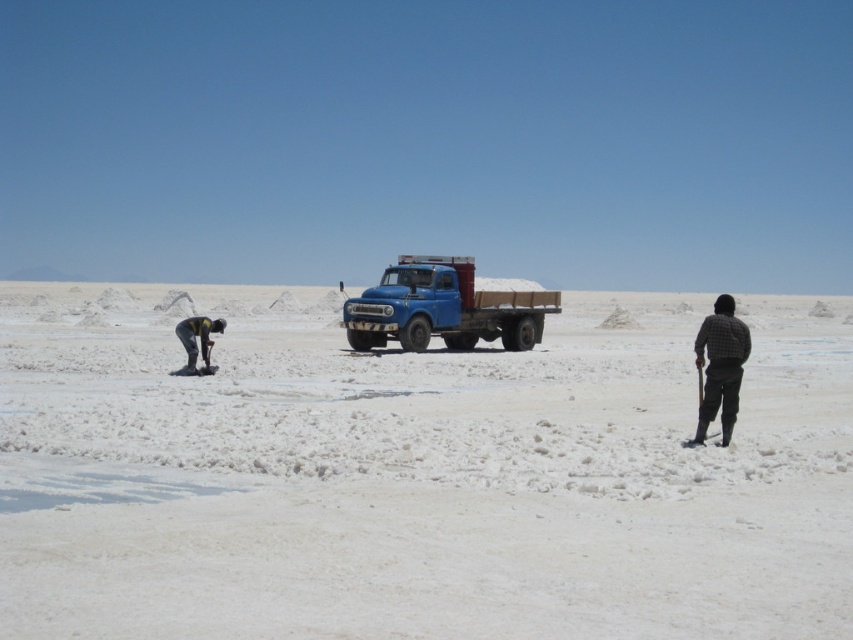
Question: Which point appears farthest from the camera in this image?

Choices:
 (A) (155, 572)
 (B) (735, 403)
 (C) (198, 324)
 (D) (451, 282)

Answer: (D)

Question: Is white sandy desert at center bigger than blue matte truck at center?

Choices:
 (A) no
 (B) yes

Answer: (B)

Question: Does white sandy desert at center have a larger size compared to plaid fabric shirt at right?

Choices:
 (A) yes
 (B) no

Answer: (A)

Question: Among these points, which one is nearest to the camera?

Choices:
 (A) (412, 595)
 (B) (200, 346)
 (C) (734, 305)

Answer: (A)

Question: Is the position of blue matte truck at center less distant than that of yellow fabric shirt at left?

Choices:
 (A) yes
 (B) no

Answer: (B)

Question: Which point is farther to the camera?

Choices:
 (A) (299, 296)
 (B) (207, 364)

Answer: (A)